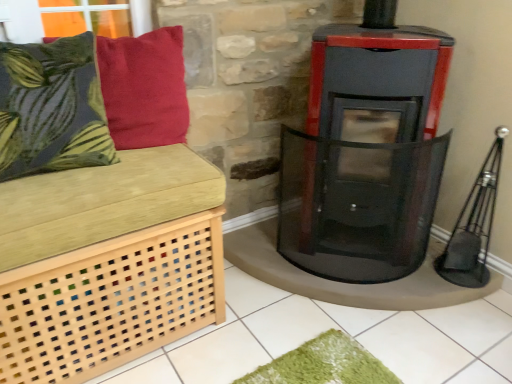
Question: Which is correct: black glass wood burning stove at center is inside light wood lattice bench at left, or outside of it?

Choices:
 (A) inside
 (B) outside

Answer: (B)

Question: Based on their positions, is black glass wood burning stove at center located to the left or right of light wood lattice bench at left?

Choices:
 (A) right
 (B) left

Answer: (A)

Question: Which is nearer to the velvety red pillow at upper left, which appears as the first pillow when viewed from the right?

Choices:
 (A) black glass wood burning stove at center
 (B) green leafy fabric cushion at left, acting as the first pillow starting from the left
 (C) light wood lattice bench at left

Answer: (B)

Question: Estimate the real-world distances between objects in this image. Which object is closer to the black glass wood burning stove at center?

Choices:
 (A) green leafy fabric cushion at left, acting as the first pillow starting from the left
 (B) velvety red pillow at upper left, which is the second pillow from left to right
 (C) light wood lattice bench at left

Answer: (B)